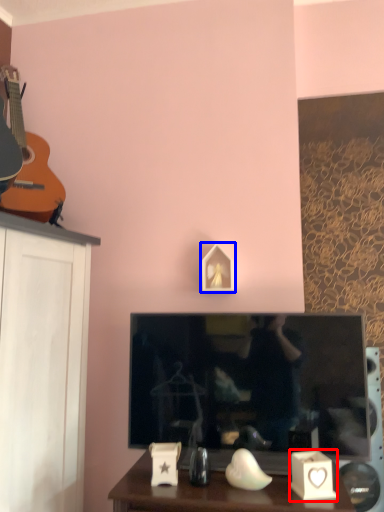
Question: Which point is further to the camera, candle holder (highlighted by a red box) or picture frame (highlighted by a blue box)?

Choices:
 (A) candle holder
 (B) picture frame

Answer: (B)